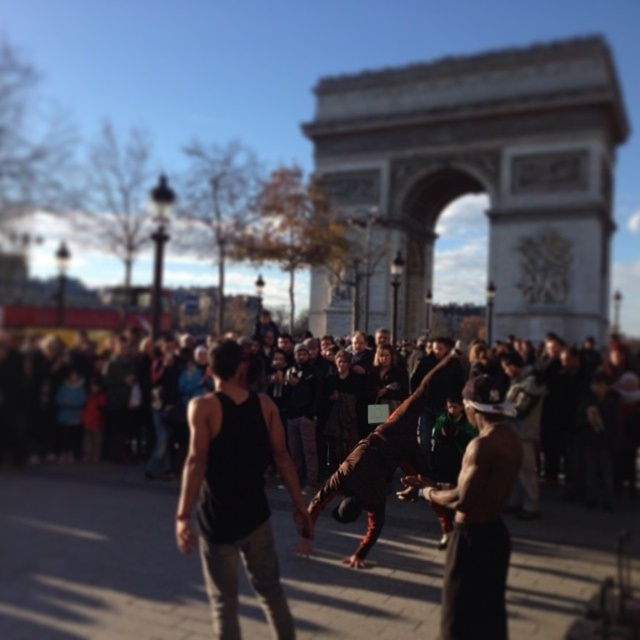
Question: Which point appears closest to the camera in this image?

Choices:
 (A) (493, 560)
 (B) (392, 433)
 (C) (294, 472)
 (D) (314, 404)

Answer: (A)

Question: Is black tank top at center smaller than shiny metallic helmet at center?

Choices:
 (A) yes
 (B) no

Answer: (B)

Question: Considering the relative positions of dark brown leather jacket at center and black tank top at center in the image provided, where is dark brown leather jacket at center located with respect to black tank top at center?

Choices:
 (A) right
 (B) left

Answer: (A)

Question: Which of the following is the closest to the observer?

Choices:
 (A) (353, 476)
 (B) (248, 461)
 (C) (474, 470)

Answer: (C)

Question: Which point is closer to the camera?

Choices:
 (A) shiny metallic helmet at center
 (B) brown leather jacket at center
 (C) black tank top at center

Answer: (A)

Question: Does dark brown leather jacket at center appear over shiny metallic helmet at center?

Choices:
 (A) yes
 (B) no

Answer: (A)